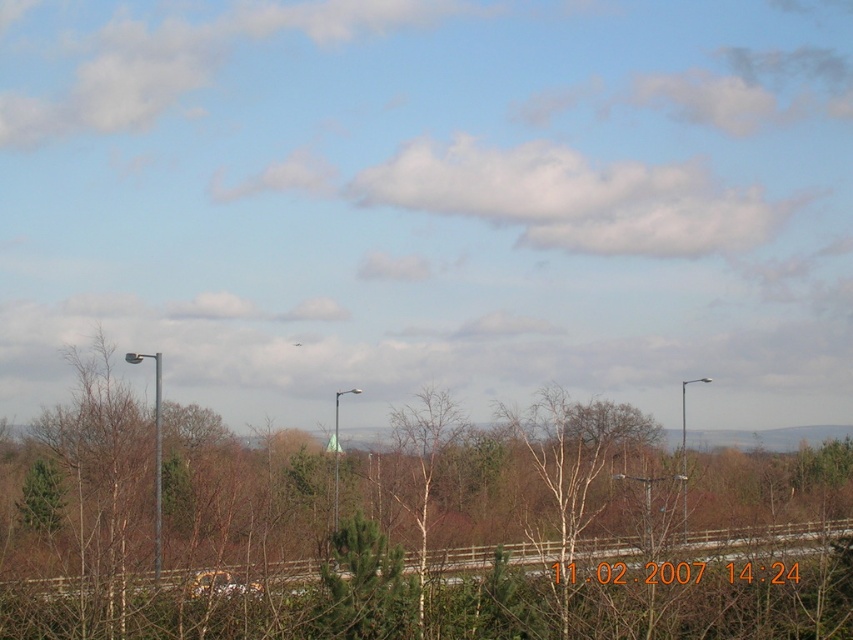
Locate an element on the screen. The width and height of the screenshot is (853, 640). brown wooden fence at lower center is located at coordinates (755, 541).

Does point (724, 545) come closer to viewer compared to point (36, 496)?

No, it is not.

Between point (51, 580) and point (44, 476), which one is positioned in front?

Point (51, 580) is in front.

Where is `brown wooden fence at lower center`? The width and height of the screenshot is (853, 640). brown wooden fence at lower center is located at coordinates (755, 541).

Does green leafy tree at center appear on the right side of metallic pole at left?

Correct, you'll find green leafy tree at center to the right of metallic pole at left.

Who is taller, green leafy tree at center or metallic pole at left?

green leafy tree at center is taller.

Does point (728, 468) come farther from viewer compared to point (154, 529)?

Yes, point (728, 468) is behind point (154, 529).

The image size is (853, 640). In order to click on green leafy tree at center in this screenshot , I will do `click(405, 529)`.

Does green matte tree at lower left appear on the left side of metallic pole at left?

Correct, you'll find green matte tree at lower left to the left of metallic pole at left.

Does green matte tree at lower left have a lesser height compared to metallic pole at left?

Yes.

In order to click on green matte tree at lower left in this screenshot , I will do point(41,499).